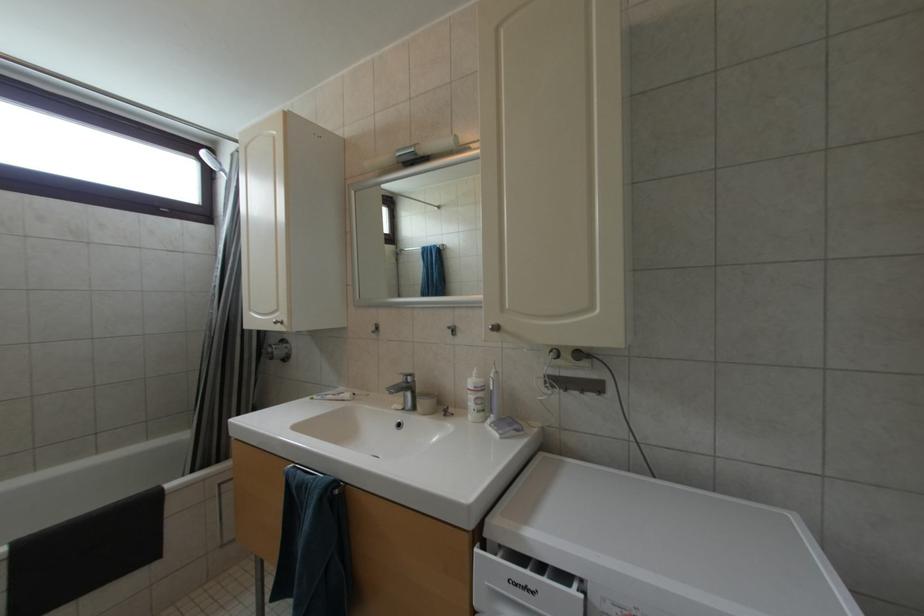
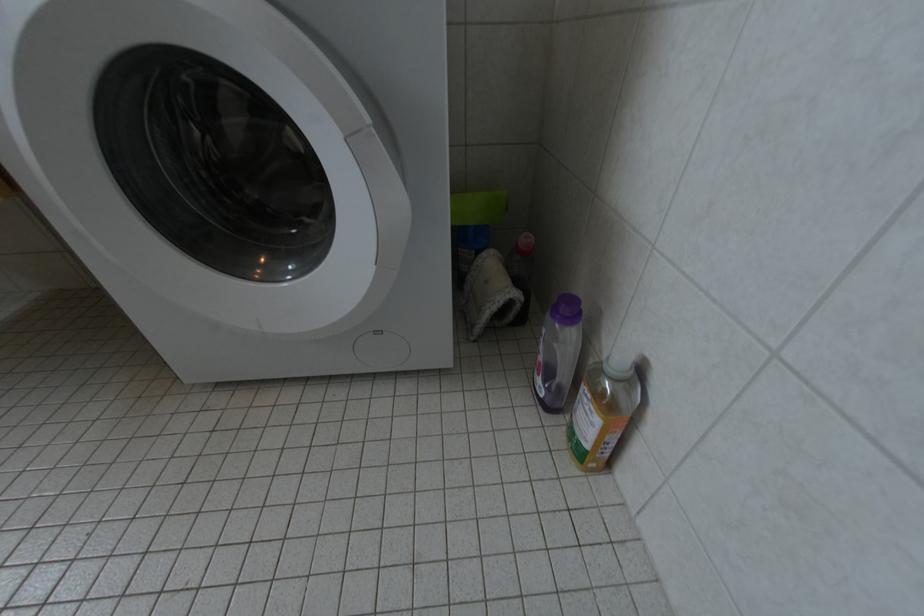
First-person continuous shooting, in which direction is the camera rotating?

The camera rotated toward right-down.